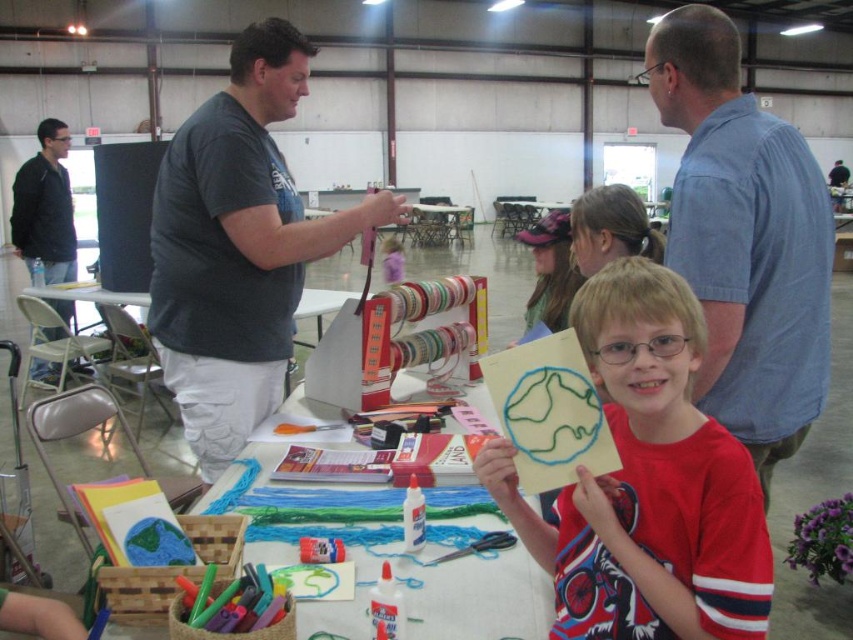
Looking at this image, does red matte paper at center appear under white paper at center?

Incorrect, red matte paper at center is not positioned below white paper at center.

Does red matte paper at center appear on the right side of white paper at center?

Correct, you'll find red matte paper at center to the right of white paper at center.

Which is in front, point (486, 488) or point (440, 627)?

Point (440, 627)

Identify the location of red matte paper at center. (647, 483).

Measure the distance between dark gray t-shirt at center and matte pink cap at upper center.

dark gray t-shirt at center is 37.44 inches from matte pink cap at upper center.

Is point (230, 404) closer to viewer compared to point (550, 243)?

Yes.

Locate an element on the screen. The height and width of the screenshot is (640, 853). dark gray t-shirt at center is located at coordinates (238, 246).

Is blue striped shirt at upper right taller than white plastic table at center?

Yes, blue striped shirt at upper right is taller than white plastic table at center.

Locate an element on the screen. Image resolution: width=853 pixels, height=640 pixels. blue striped shirt at upper right is located at coordinates (744, 237).

You are a GUI agent. You are given a task and a screenshot of the screen. Output one action in this format:
    pyautogui.click(x=<x>, y=<y>)
    Task: Click on the blue striped shirt at upper right
    This screenshot has height=640, width=853.
    Given the screenshot: What is the action you would take?
    pyautogui.click(x=744, y=237)